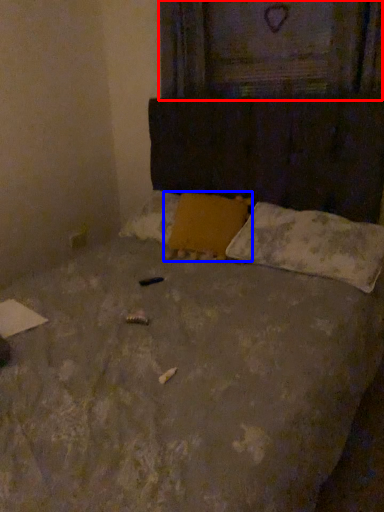
Question: Which object appears farthest to the camera in this image, window frame (highlighted by a red box) or pillow (highlighted by a blue box)?

Choices:
 (A) window frame
 (B) pillow

Answer: (A)